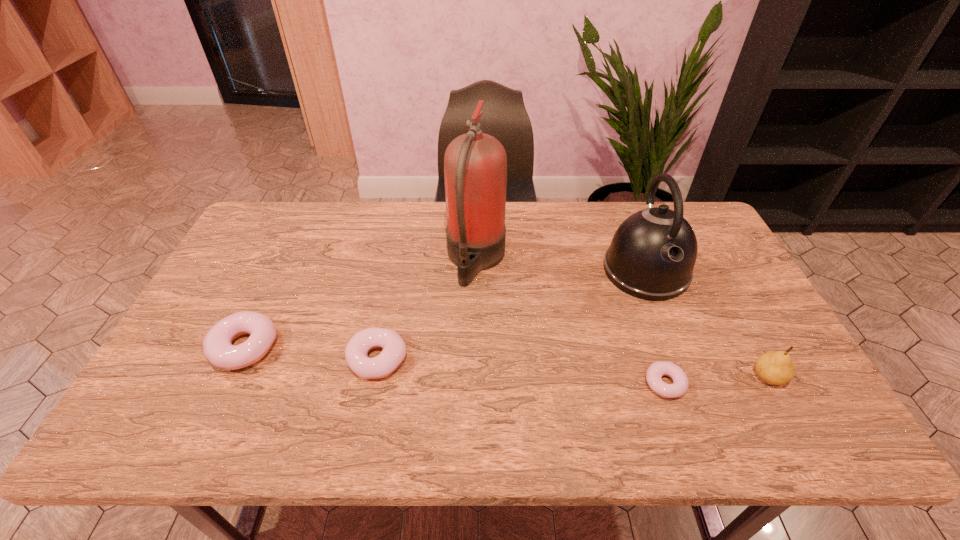
Identify the location of object that stands as the closest to the tallest object. The width and height of the screenshot is (960, 540). (394, 350).

Identify which object is the fifth nearest to the second doughnut from right to left. Please provide its 2D coordinates. Your answer should be formatted as a tuple, i.e. [(x, y)], where the tuple contains the x and y coordinates of a point satisfying the conditions above.

[(775, 367)]

Where is `the second closest doughnut to the pear`? the second closest doughnut to the pear is located at coordinates (394, 350).

Identify which doughnut is located as the nearest to the shortest doughnut. Please provide its 2D coordinates. Your answer should be formatted as a tuple, i.e. [(x, y)], where the tuple contains the x and y coordinates of a point satisfying the conditions above.

[(394, 350)]

This screenshot has height=540, width=960. I want to click on vacant region that satisfies the following two spatial constraints: 1. at the nozzle of the third object from left to right; 2. on the back side of the shortest object, so click(x=475, y=383).

Identify the location of vacant space that satisfies the following two spatial constraints: 1. on the spout of the rightmost object; 2. on the right side of the kettle. The width and height of the screenshot is (960, 540). (687, 377).

Find the location of a particular element. This screenshot has width=960, height=540. vacant space that satisfies the following two spatial constraints: 1. at the nozzle of the tallest object; 2. on the front side of the leftmost object is located at coordinates (475, 347).

Locate an element on the screen. This screenshot has width=960, height=540. vacant region that satisfies the following two spatial constraints: 1. at the nozzle of the fourth shortest object; 2. on the left side of the fourth object from right to left is located at coordinates (475, 377).